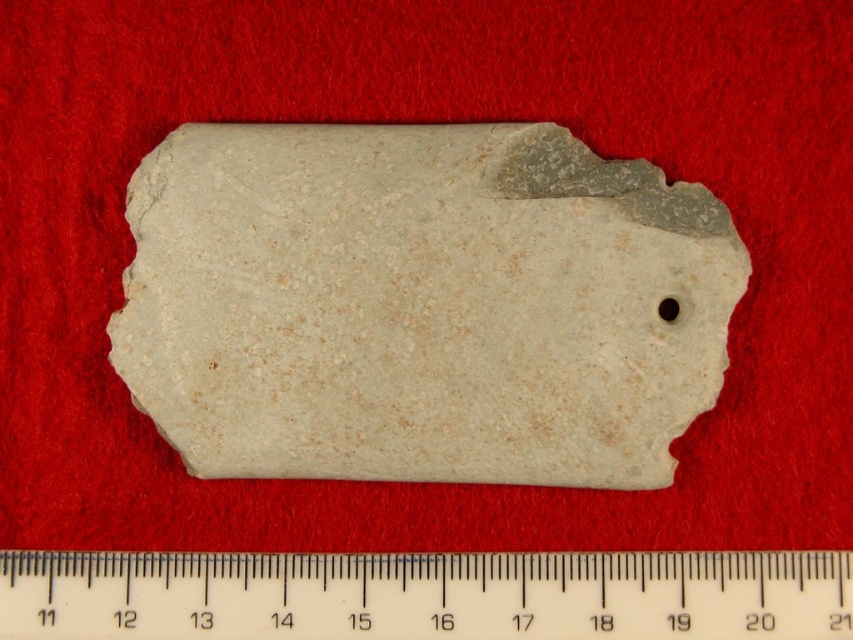
You are an archaeologist examining the white stone at center. If you want to reach into your backpack to retrieve a measuring tape, will you need to lean forward to do so?

The white stone at center is 4.20 feet away from viewer, so you will need to lean forward to reach it while examining the white stone at center.

You are an archaeologist examining the white stone at center and the white plastic ruler at bottom in the image. Which object is closer to your eyes?

The white stone at center is closer to you than the white plastic ruler at bottom because it is positioned further to the viewer in the image.